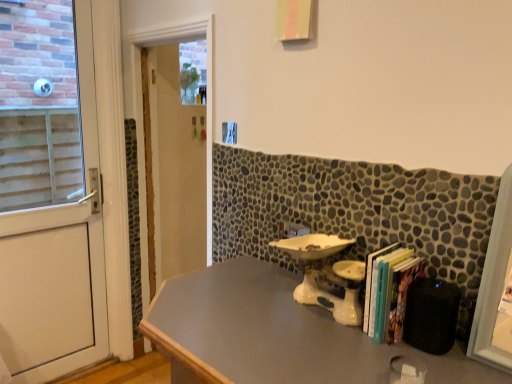
Question: Is white matte door at left not inside white glossy door at center?

Choices:
 (A) no
 (B) yes

Answer: (B)

Question: Is white glossy door at center at the back of white matte door at left?

Choices:
 (A) yes
 (B) no

Answer: (B)

Question: Is white glossy door at center located within white matte door at left?

Choices:
 (A) yes
 (B) no

Answer: (B)

Question: From the image's perspective, is white matte door at left located above white glossy door at center?

Choices:
 (A) no
 (B) yes

Answer: (B)

Question: From the image's perspective, is white matte door at left located beneath white glossy door at center?

Choices:
 (A) no
 (B) yes

Answer: (A)

Question: Looking at the image, does white matte door at left seem bigger or smaller compared to hardcover books at right?

Choices:
 (A) small
 (B) big

Answer: (B)

Question: Visually, is white matte door at left positioned to the left or to the right of hardcover books at right?

Choices:
 (A) right
 (B) left

Answer: (B)

Question: Is white matte door at left taller or shorter than hardcover books at right?

Choices:
 (A) tall
 (B) short

Answer: (A)

Question: From the image's perspective, is white matte door at left above or below hardcover books at right?

Choices:
 (A) above
 (B) below

Answer: (A)

Question: Considering the positions of white matte door at left and white glossy door at center in the image, is white matte door at left wider or thinner than white glossy door at center?

Choices:
 (A) wide
 (B) thin

Answer: (B)

Question: Considering the positions of white matte door at left and white glossy door at center in the image, is white matte door at left bigger or smaller than white glossy door at center?

Choices:
 (A) big
 (B) small

Answer: (B)

Question: From the image's perspective, relative to white glossy door at center, is white matte door at left above or below?

Choices:
 (A) above
 (B) below

Answer: (A)

Question: Considering the relative positions of white matte door at left and white glossy door at center in the image provided, is white matte door at left to the left or to the right of white glossy door at center?

Choices:
 (A) right
 (B) left

Answer: (B)

Question: Considering the relative positions of smooth gray table at center and white ceramic sink at center in the image provided, is smooth gray table at center to the left or to the right of white ceramic sink at center?

Choices:
 (A) right
 (B) left

Answer: (B)

Question: In terms of height, does smooth gray table at center look taller or shorter compared to white ceramic sink at center?

Choices:
 (A) tall
 (B) short

Answer: (A)